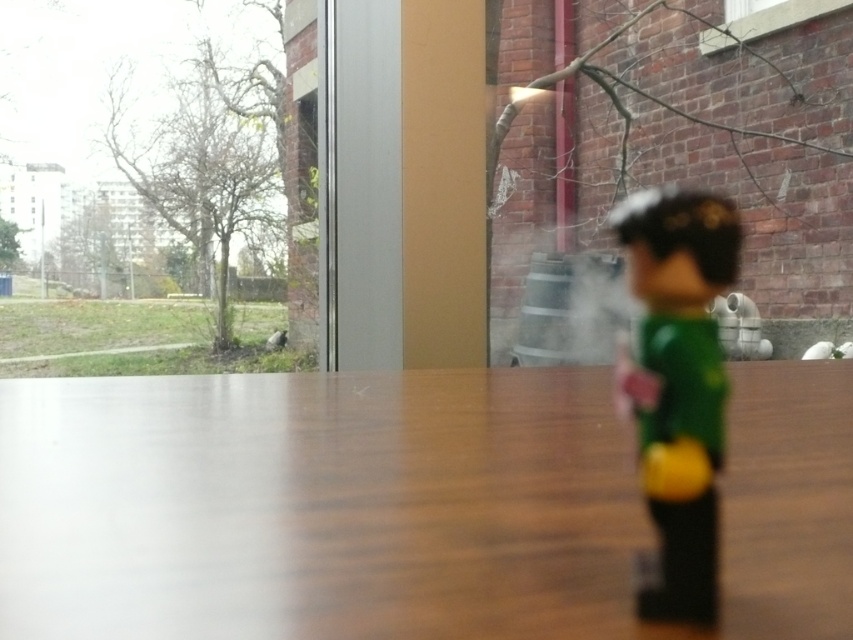
Who is positioned more to the right, wooden table at center or green matte toy at right?

green matte toy at right

Is wooden table at center smaller than green matte toy at right?

Indeed, wooden table at center has a smaller size compared to green matte toy at right.

This screenshot has width=853, height=640. What do you see at coordinates (318, 506) in the screenshot? I see `wooden table at center` at bounding box center [318, 506].

In order to click on wooden table at center in this screenshot , I will do `click(318, 506)`.